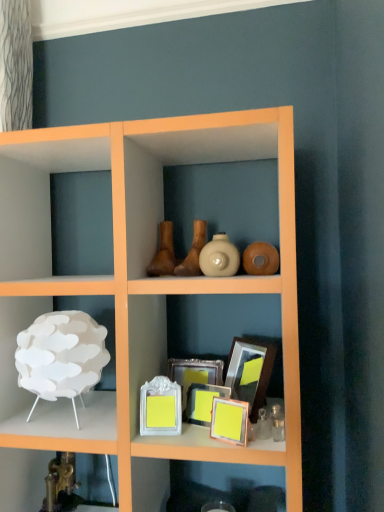
Question: From their relative heights in the image, would you say white matte lamp at left, which is counted as the first shelf, starting from the top, is taller or shorter than matte yellow picture frame at center, arranged as the 4th picture frame when viewed from the back?

Choices:
 (A) short
 (B) tall

Answer: (B)

Question: From a real-world perspective, is white matte lamp at left, which ranks as the second shelf in bottom-to-top order, positioned above or below matte yellow picture frame at center, which appears as the 1th picture frame when viewed from the front?

Choices:
 (A) above
 (B) below

Answer: (A)

Question: Based on their relative distances, which object is farther from the brown matte vase at center, arranged as the 2th vase when viewed from the right?

Choices:
 (A) white matte lamp at left, which is counted as the first shelf, starting from the top
 (B) white glossy vase at center, which is counted as the first vase, starting from the right
 (C) white glossy picture frame at center, which is the third picture frame from back to front
 (D) yellow matte picture frame at center, the 3th picture frame from the front
 (E) matte yellow picture frame at center, arranged as the 4th picture frame when viewed from the back

Answer: (A)

Question: Considering the real-world distances, which object is farthest from the matte brown vase at center, the third vase in the right-to-left sequence?

Choices:
 (A) matte yellow picture frame at center, which appears as the 1th picture frame when viewed from the front
 (B) brown matte vase at center, the second vase when ordered from left to right
 (C) white glossy vase at center, which is counted as the first vase, starting from the right
 (D) metallic gold faucet at lower left, which is counted as the 2th shelf, starting from the top
 (E) yellow matte picture frame at center, the 3th picture frame from the front

Answer: (D)